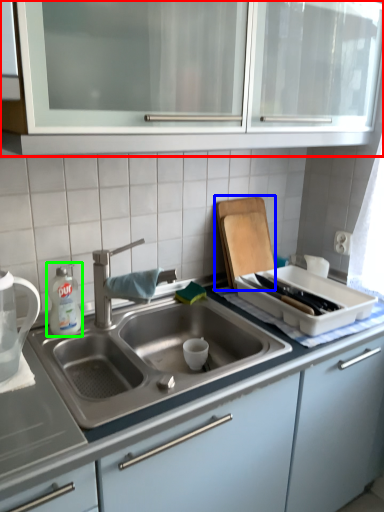
Question: Estimate the real-world distances between objects in this image. Which object is closer to cabinetry (highlighted by a red box), cutting board (highlighted by a blue box) or cleaning product (highlighted by a green box)?

Choices:
 (A) cutting board
 (B) cleaning product

Answer: (A)